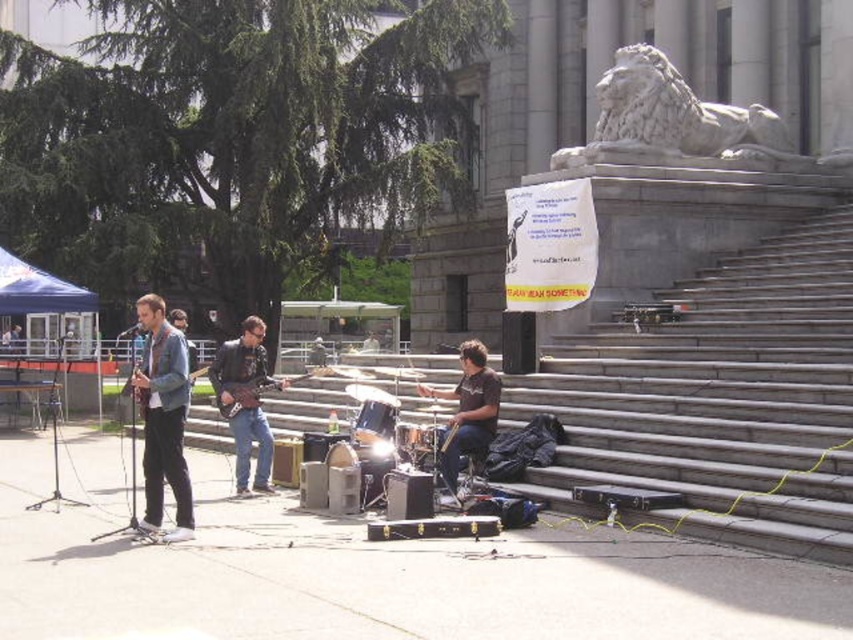
You are standing at the top of the stone steps where the large stone lion statue is located. You want to walk down to the street performer area. If you look down the steps, you see two points marked on the steps. The first point is at coordinates point (149, 312) and the second point is at point (223, 349). Which point should you step on first to start descending the steps?

You should step on point (149, 312) first because it is in front of point (223, 349), meaning it is closer to your current position at the top of the steps.

You are a photographer standing at the bottom of the stone steps. You want to take a photo of the denim jacket at left and the wooden electric guitar at center so that both are clearly visible in the frame. Given that your camera has a maximum focus range of 3 meters, will you be able to capture both objects in focus without moving closer?

The distance between the denim jacket at left and wooden electric guitar at center is 3.14 meters. Since the camera can only focus within 3 meters, the objects are slightly out of the focus range. Therefore, you might need to move closer to ensure both are in focus.

You are a photographer standing at the bottom of the stone steps. You want to take a photo that includes both the denim jacket at left and the wooden guitar at center. Given that your camera has a maximum focus range of 3 meters, will you be able to capture both subjects in focus?

The denim jacket at left is 3.62 meters from the wooden guitar at center. Since the distance between them exceeds the camera maximum focus range of 3 meters, you will not be able to capture both subjects in focus.